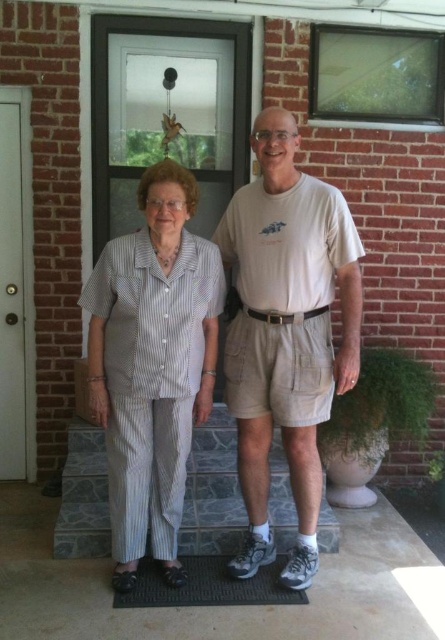
Between white cotton t-shirt at center and stonework at center, which one appears on the right side from the viewer's perspective?

From the viewer's perspective, white cotton t-shirt at center appears more on the right side.

Does white cotton t-shirt at center have a larger size compared to stonework at center?

Correct, white cotton t-shirt at center is larger in size than stonework at center.

You are a GUI agent. You are given a task and a screenshot of the screen. Output one action in this format:
    pyautogui.click(x=<x>, y=<y>)
    Task: Click on the white cotton t-shirt at center
    
    Given the screenshot: What is the action you would take?
    pyautogui.click(x=287, y=332)

Does stonework at center have a smaller size compared to green rubber doormat at lower center?

No.

Does stonework at center appear on the left side of green rubber doormat at lower center?

No, stonework at center is not to the left of green rubber doormat at lower center.

The width and height of the screenshot is (445, 640). Identify the location of stonework at center. tap(213, 490).

You are a GUI agent. You are given a task and a screenshot of the screen. Output one action in this format:
    pyautogui.click(x=<x>, y=<y>)
    Task: Click on the white striped pajamas at center
    
    Given the screenshot: What is the action you would take?
    pyautogui.click(x=153, y=364)

Between white striped pajamas at center and stonework at center, which one has less height?

With less height is stonework at center.

Is point (164, 324) closer to camera compared to point (230, 538)?

That is True.

The width and height of the screenshot is (445, 640). In order to click on white striped pajamas at center in this screenshot , I will do `click(153, 364)`.